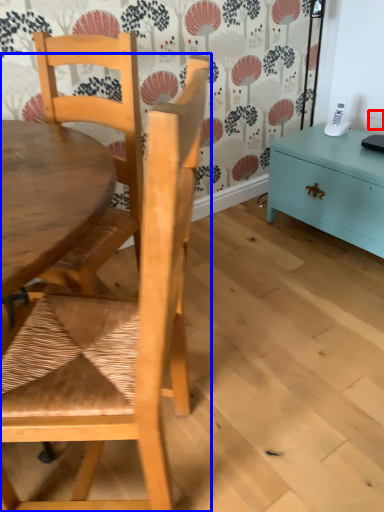
Question: Which of the following is the farthest to the observer, power outlet (highlighted by a red box) or chair (highlighted by a blue box)?

Choices:
 (A) power outlet
 (B) chair

Answer: (A)